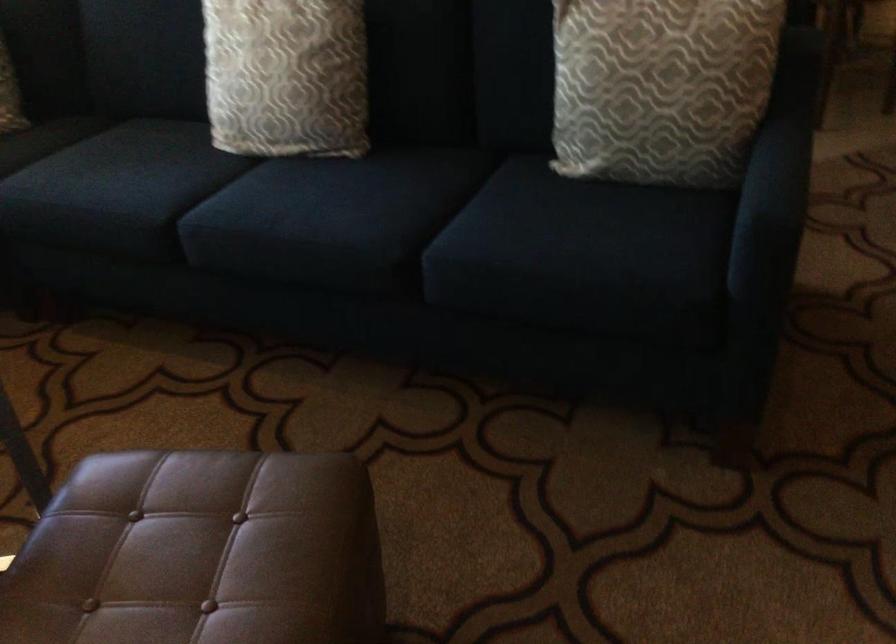
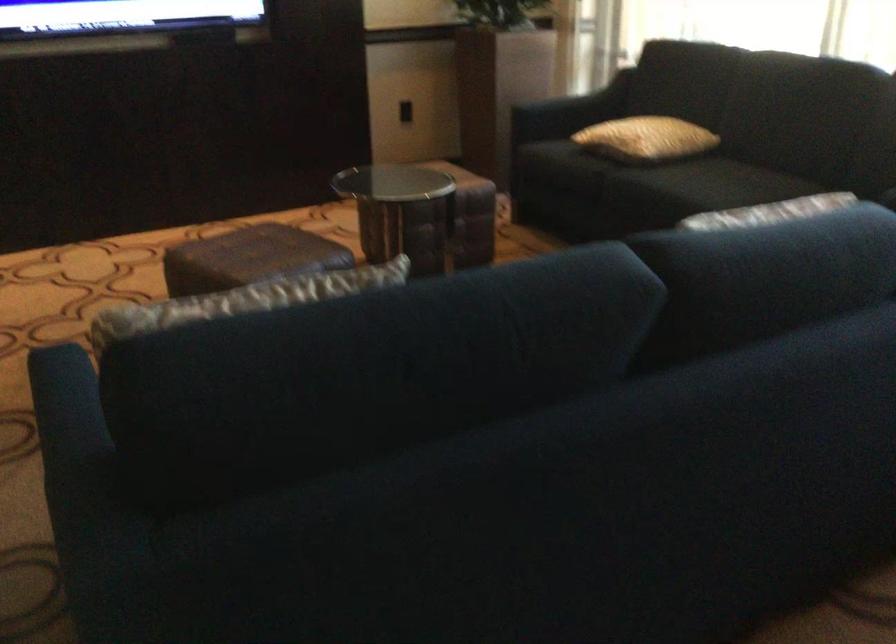
The point at (251, 522) is marked in the first image. Where is the corresponding point in the second image?

(248, 258)